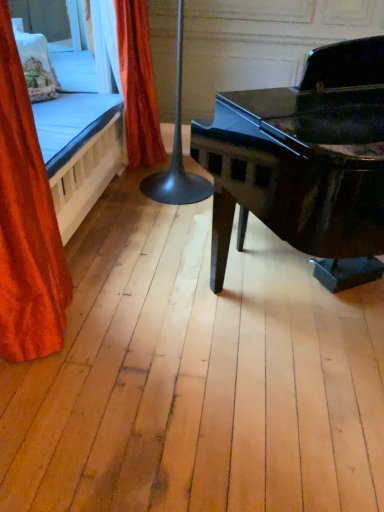
The image size is (384, 512). In order to click on free space in front of orange velvet curtain at left, the second curtain positioned from the back in this screenshot , I will do `click(53, 390)`.